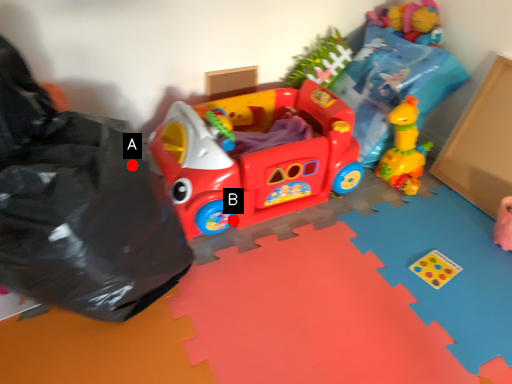
Question: Two points are circled on the image, labeled by A and B beside each circle. Which point is closer to the camera taking this photo?

Choices:
 (A) A is closer
 (B) B is closer

Answer: (A)